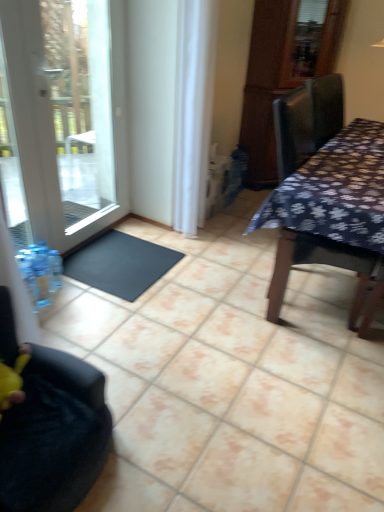
Where is `vacant area that lies to the right of black rubber doormat at lower left`? The width and height of the screenshot is (384, 512). vacant area that lies to the right of black rubber doormat at lower left is located at coordinates (209, 272).